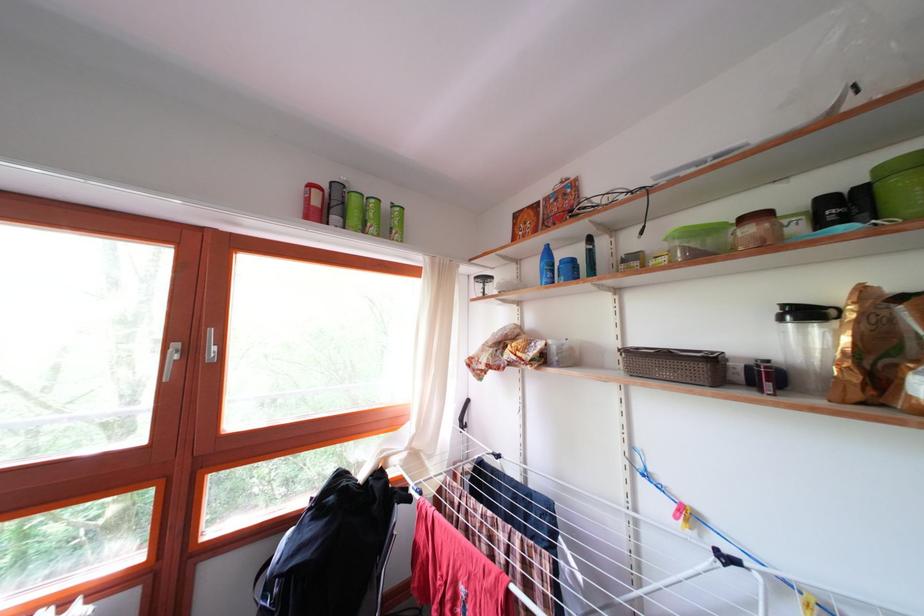
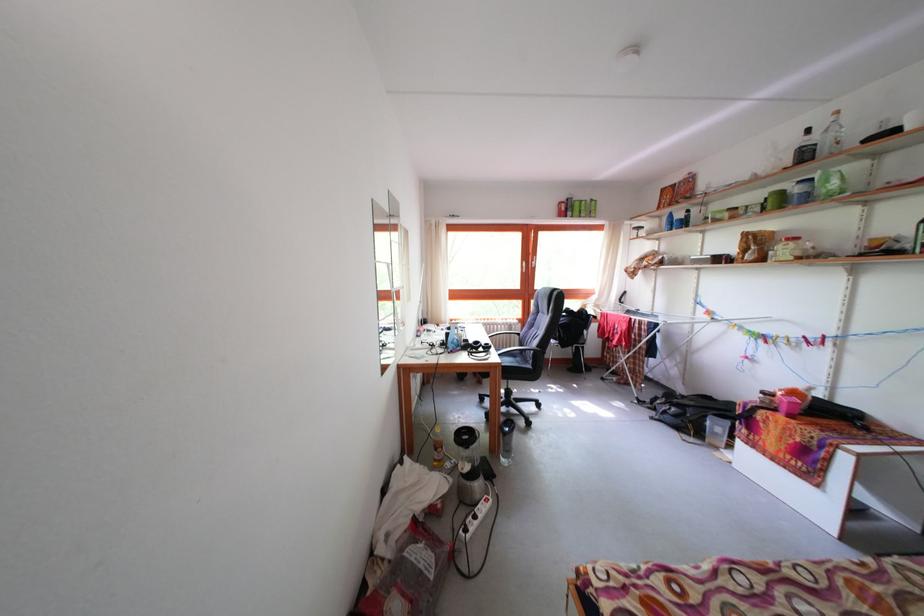
In the second image, find the point that corresponds to (526,267) in the first image.

(667, 224)